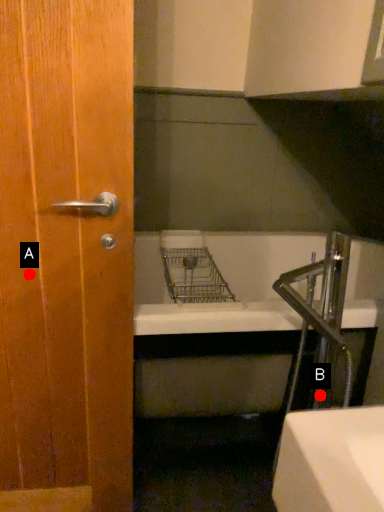
Question: Two points are circled on the image, labeled by A and B beside each circle. Among these points, which one is farthest from the camera?

Choices:
 (A) A is further
 (B) B is further

Answer: (B)